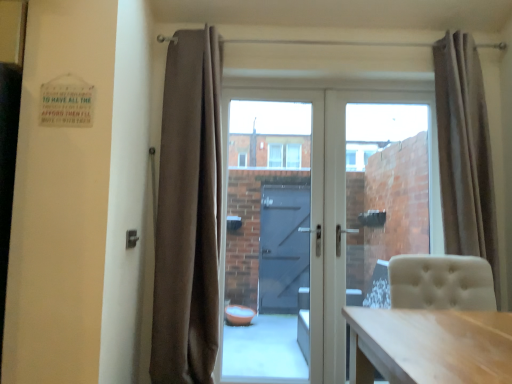
Question: Is transparent glass door at center, the second glass door when ordered from right to left, wider than beige fabric curtain at right, arranged as the 2th curtain when viewed from the left?

Choices:
 (A) no
 (B) yes

Answer: (A)

Question: Does transparent glass door at center, the second glass door when ordered from right to left, turn towards beige fabric curtain at right, arranged as the 2th curtain when viewed from the left?

Choices:
 (A) no
 (B) yes

Answer: (A)

Question: Would you say beige fabric curtain at right, arranged as the 2th curtain when viewed from the left, is part of transparent glass door at center, the second glass door when ordered from right to left,'s contents?

Choices:
 (A) no
 (B) yes

Answer: (A)

Question: Does transparent glass door at center, the second glass door when ordered from right to left, appear on the right side of beige fabric curtain at right, arranged as the 2th curtain when viewed from the left?

Choices:
 (A) no
 (B) yes

Answer: (A)

Question: Is transparent glass door at center, the second glass door when ordered from right to left, closer to camera compared to beige fabric curtain at right, which is the first curtain from right to left?

Choices:
 (A) yes
 (B) no

Answer: (B)

Question: Visually, is beige fabric curtain at right, which is the first curtain from right to left, positioned to the left or to the right of transparent glass door at center, which is counted as the 2th glass door, starting from the left?

Choices:
 (A) right
 (B) left

Answer: (A)

Question: In terms of height, does beige fabric curtain at right, which is the first curtain from right to left, look taller or shorter compared to transparent glass door at center, which is counted as the 2th glass door, starting from the left?

Choices:
 (A) tall
 (B) short

Answer: (B)

Question: Looking at their shapes, would you say beige fabric curtain at right, which is the first curtain from right to left, is wider or thinner than transparent glass door at center, which is counted as the 2th glass door, starting from the left?

Choices:
 (A) thin
 (B) wide

Answer: (B)

Question: Looking at the image, does beige fabric curtain at right, which is the first curtain from right to left, seem bigger or smaller compared to transparent glass door at center, the 1th glass door in the right-to-left sequence?

Choices:
 (A) small
 (B) big

Answer: (B)

Question: From the image's perspective, relative to transparent glass door at center, which is counted as the 2th glass door, starting from the left, is brown velvet curtain at center, which ranks as the second curtain in right-to-left order, above or below?

Choices:
 (A) above
 (B) below

Answer: (A)

Question: Based on their positions, is brown velvet curtain at center, which ranks as the second curtain in right-to-left order, located to the left or right of transparent glass door at center, the 1th glass door in the right-to-left sequence?

Choices:
 (A) right
 (B) left

Answer: (B)

Question: Considering their positions, is brown velvet curtain at center, which is the 1th curtain in left-to-right order, located in front of or behind transparent glass door at center, the 1th glass door in the right-to-left sequence?

Choices:
 (A) front
 (B) behind

Answer: (A)

Question: In terms of size, does brown velvet curtain at center, which ranks as the second curtain in right-to-left order, appear bigger or smaller than transparent glass door at center, the 1th glass door in the right-to-left sequence?

Choices:
 (A) big
 (B) small

Answer: (A)

Question: Looking at their shapes, would you say transparent glass door at center, marked as the first glass door in a left-to-right arrangement, is wider or thinner than white glass door at center?

Choices:
 (A) wide
 (B) thin

Answer: (B)

Question: From their relative heights in the image, would you say transparent glass door at center, the second glass door when ordered from right to left, is taller or shorter than white glass door at center?

Choices:
 (A) tall
 (B) short

Answer: (B)